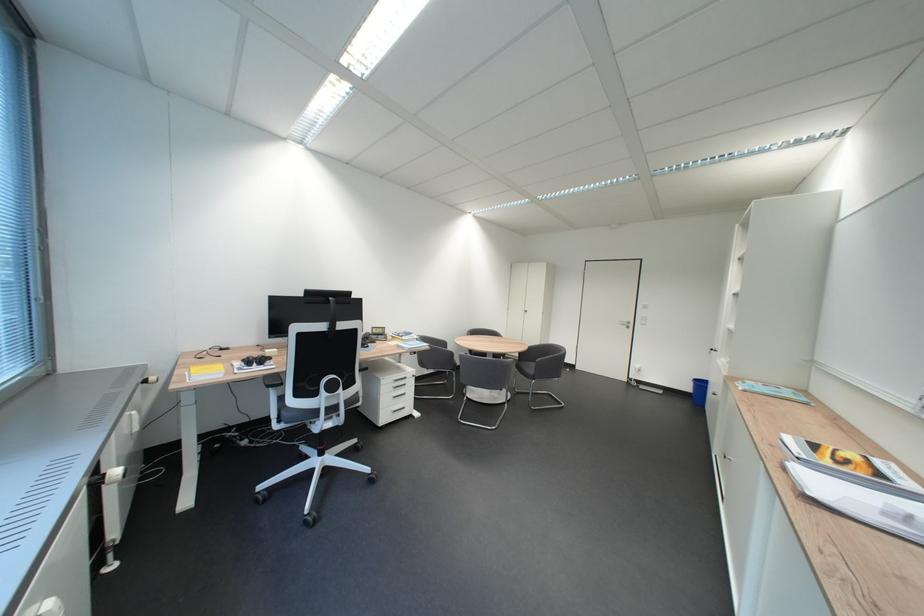
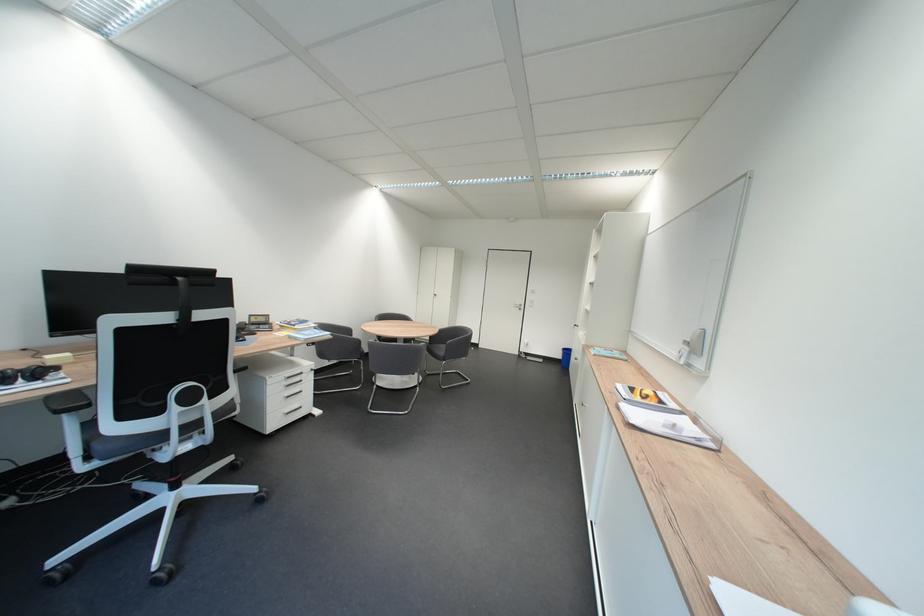
The point at (545,366) is marked in the first image. Where is the corresponding point in the second image?

(456, 347)